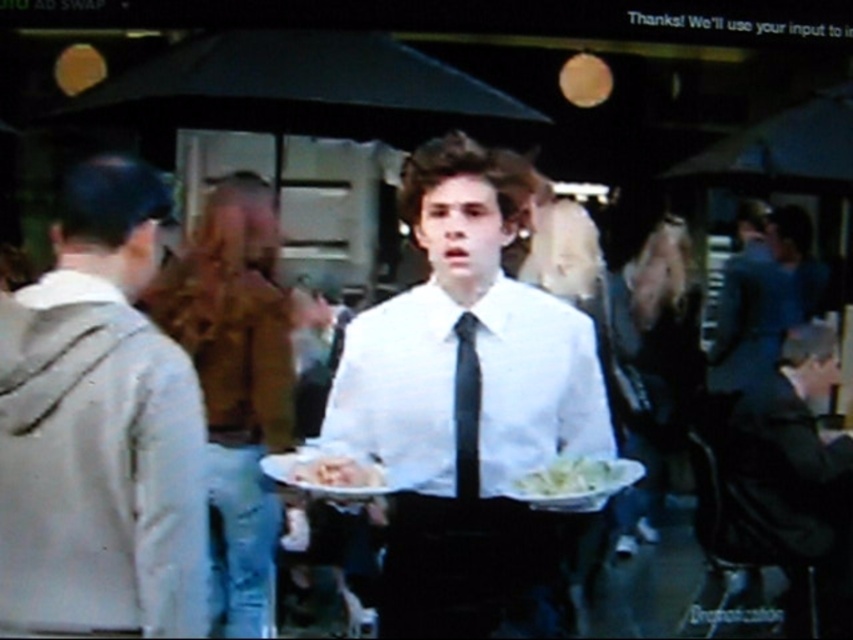
You are a guest at a party and see the dark blue shirt at center and the white paper plate at center. Which one is closer to you?

The dark blue shirt at center is closer to you because the white paper plate at center is behind it.

Based on the scene described, which object is positioned higher when observing the image from the front? The question must mention both the white smooth shirt at center and the white glossy plate at center without revealing their spatial relationship.

The white smooth shirt at center is positioned higher than the white glossy plate at center.